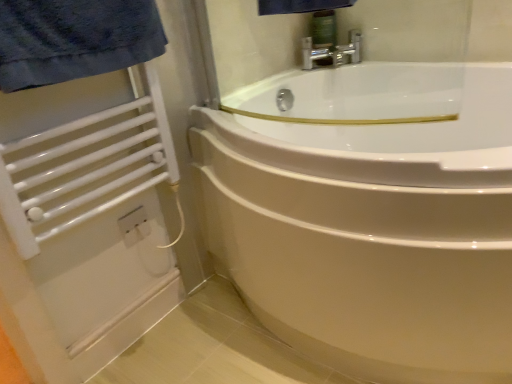
Question: Is white glossy bathtub at center bigger or smaller than white metal towel rack at left?

Choices:
 (A) big
 (B) small

Answer: (A)

Question: Considering the positions of white glossy bathtub at center and white metal towel rack at left in the image, is white glossy bathtub at center wider or thinner than white metal towel rack at left?

Choices:
 (A) thin
 (B) wide

Answer: (B)

Question: Would you say white glossy bathtub at center is inside or outside white metal towel rack at left?

Choices:
 (A) inside
 (B) outside

Answer: (B)

Question: Relative to white glossy bathtub at center, is white metal towel rack at left in front or behind?

Choices:
 (A) behind
 (B) front

Answer: (A)

Question: Looking at their shapes, would you say white metal towel rack at left is wider or thinner than white glossy bathtub at center?

Choices:
 (A) wide
 (B) thin

Answer: (B)

Question: From the image's perspective, is white metal towel rack at left located above or below white glossy bathtub at center?

Choices:
 (A) below
 (B) above

Answer: (B)

Question: From a real-world perspective, is white metal towel rack at left above or below white glossy bathtub at center?

Choices:
 (A) above
 (B) below

Answer: (A)